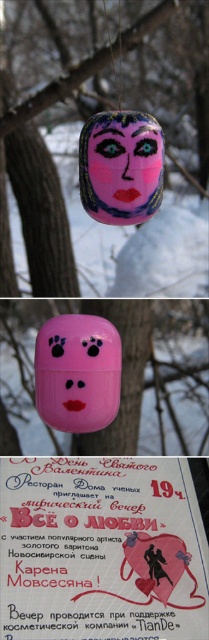
Does matte pink poster at center appear on the left side of pink matte toy at center?

In fact, matte pink poster at center is to the right of pink matte toy at center.

Does point (140, 611) come in front of point (67, 403)?

That is True.

The image size is (209, 640). Identify the location of matte pink poster at center. (100, 548).

Is slightly glossy wood at upper center thinner than pink matte toy at center?

No.

This screenshot has width=209, height=640. What do you see at coordinates (67, 83) in the screenshot?
I see `slightly glossy wood at upper center` at bounding box center [67, 83].

Where is `slightly glossy wood at upper center`? slightly glossy wood at upper center is located at coordinates (67, 83).

Between pink matte toy at center and matte pink face at center, which one is positioned higher?

matte pink face at center is above.

Can you confirm if pink matte toy at center is positioned below matte pink face at center?

Yes, pink matte toy at center is below matte pink face at center.

You are a GUI agent. You are given a task and a screenshot of the screen. Output one action in this format:
    pyautogui.click(x=<x>, y=<y>)
    Task: Click on the pink matte toy at center
    The height and width of the screenshot is (640, 209).
    Given the screenshot: What is the action you would take?
    pyautogui.click(x=77, y=372)

Identify the location of pink matte toy at center. (77, 372).